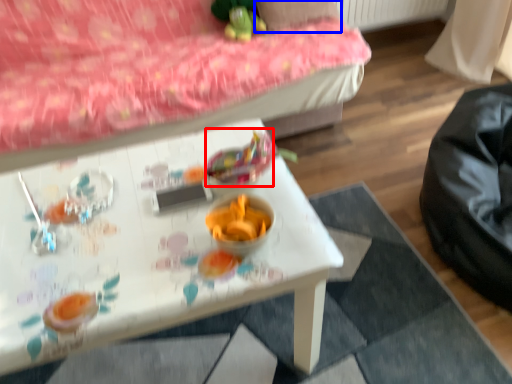
Question: Among these objects, which one is farthest to the camera, food (highlighted by a red box) or pillow (highlighted by a blue box)?

Choices:
 (A) food
 (B) pillow

Answer: (B)